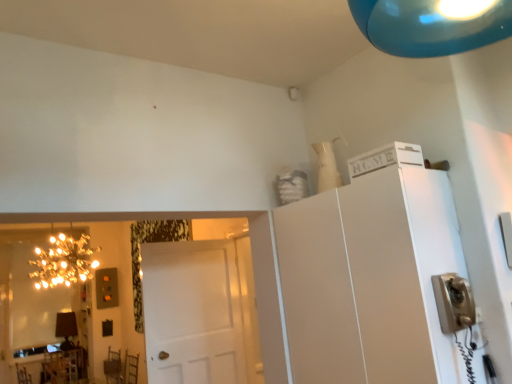
Question: From the image's perspective, is white matte door at center below wooden table at lower left?

Choices:
 (A) yes
 (B) no

Answer: (B)

Question: Is white matte door at center in front of wooden table at lower left?

Choices:
 (A) no
 (B) yes

Answer: (B)

Question: Could you tell me if white matte door at center is facing wooden table at lower left?

Choices:
 (A) no
 (B) yes

Answer: (A)

Question: Can you confirm if white matte door at center is bigger than wooden table at lower left?

Choices:
 (A) no
 (B) yes

Answer: (A)

Question: Considering the relative sizes of white matte door at center and wooden table at lower left in the image provided, is white matte door at center wider than wooden table at lower left?

Choices:
 (A) no
 (B) yes

Answer: (A)

Question: Is white matte door at center behind wooden table at lower left?

Choices:
 (A) no
 (B) yes

Answer: (A)

Question: Does gold reflective mirror at left have a lesser height compared to white matte cabinet at upper right?

Choices:
 (A) yes
 (B) no

Answer: (B)

Question: Is gold reflective mirror at left to the right of white matte cabinet at upper right from the viewer's perspective?

Choices:
 (A) no
 (B) yes

Answer: (A)

Question: From the image's perspective, does gold reflective mirror at left appear higher than white matte cabinet at upper right?

Choices:
 (A) no
 (B) yes

Answer: (A)

Question: From a real-world perspective, is gold reflective mirror at left located beneath white matte cabinet at upper right?

Choices:
 (A) yes
 (B) no

Answer: (B)

Question: Is gold reflective mirror at left facing towards white matte cabinet at upper right?

Choices:
 (A) yes
 (B) no

Answer: (A)

Question: Could white matte cabinet at upper right be considered to be inside gold reflective mirror at left?

Choices:
 (A) yes
 (B) no

Answer: (B)

Question: Is matte black lamp at lower left further to the viewer compared to white matte door at center?

Choices:
 (A) no
 (B) yes

Answer: (B)